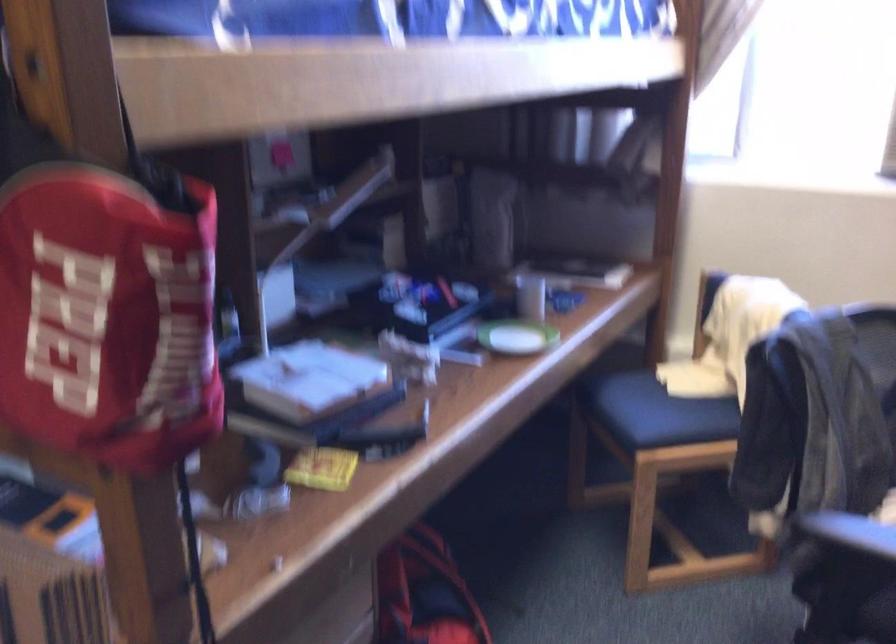
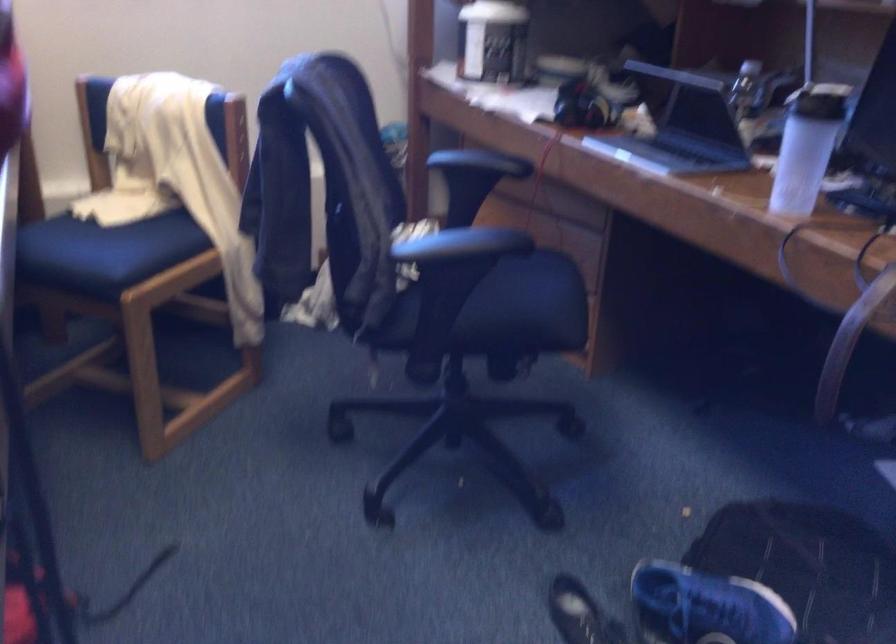
Where in the second image is the point corresponding to (x=694, y=368) from the first image?

(123, 200)